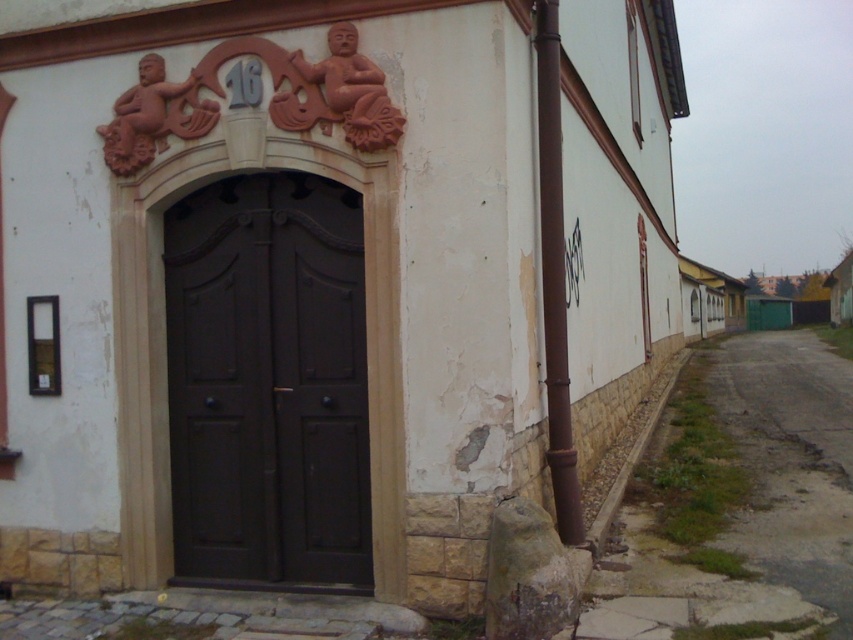
Question: Does brown metallic pipe at right have a greater width compared to terracotta textured figure at upper center?

Choices:
 (A) yes
 (B) no

Answer: (B)

Question: Does matte dark brown door at center appear under green grass at lower right?

Choices:
 (A) yes
 (B) no

Answer: (B)

Question: Is brown metallic pipe at right smaller than terracotta textured figure at upper center?

Choices:
 (A) yes
 (B) no

Answer: (B)

Question: Which object is the closest to the terracotta textured figure at upper center?

Choices:
 (A) matte dark brown door at center
 (B) green grass at lower right
 (C) brown metallic pipe at right

Answer: (A)

Question: Which is farther from the terracotta textured sculpture at upper center?

Choices:
 (A) green grass at lower right
 (B) terracotta textured figure at upper center
 (C) brown metallic pipe at right
 (D) matte dark brown door at center

Answer: (A)

Question: Estimate the real-world distances between objects in this image. Which object is farther from the matte dark brown door at center?

Choices:
 (A) green grass at lower right
 (B) terracotta textured figure at upper center
 (C) terracotta textured sculpture at upper center
 (D) brown metallic pipe at right

Answer: (A)